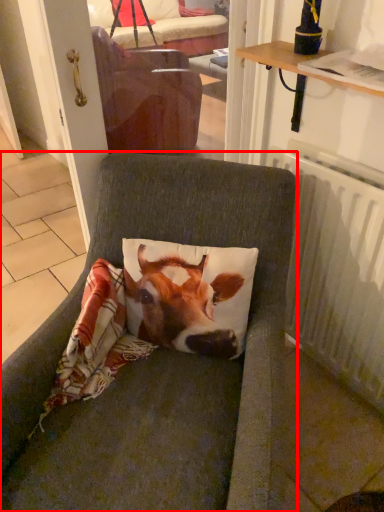
Question: From the image, what is the correct spatial relationship of chair (annotated by the red box) in relation to radiator?

Choices:
 (A) right
 (B) left

Answer: (B)